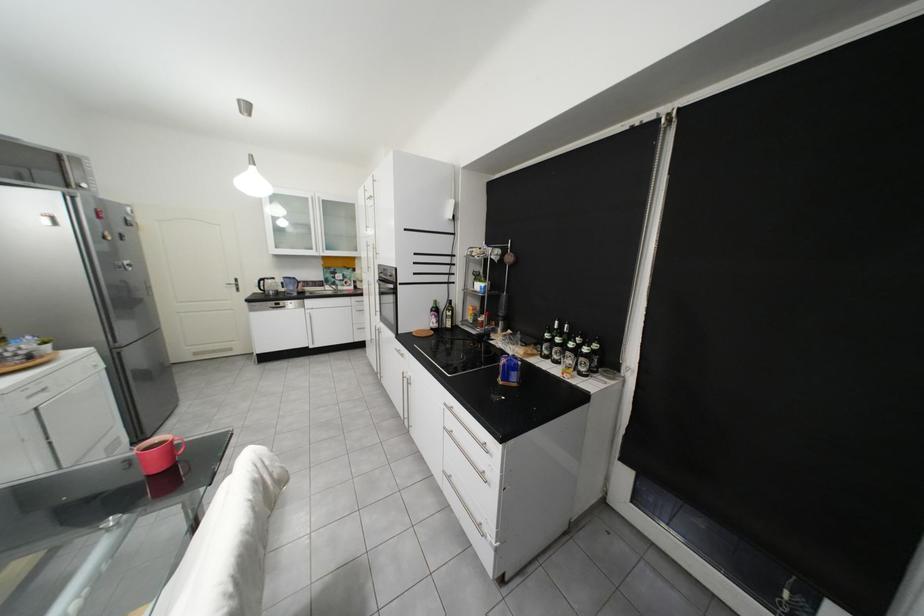
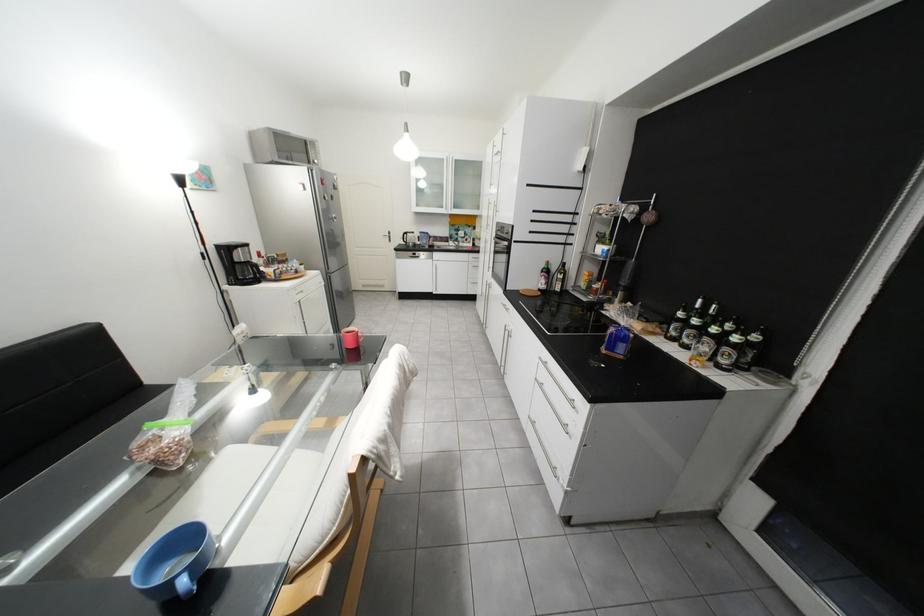
Find the pixel in the second image that matches point 66,219 in the first image.

(315, 185)